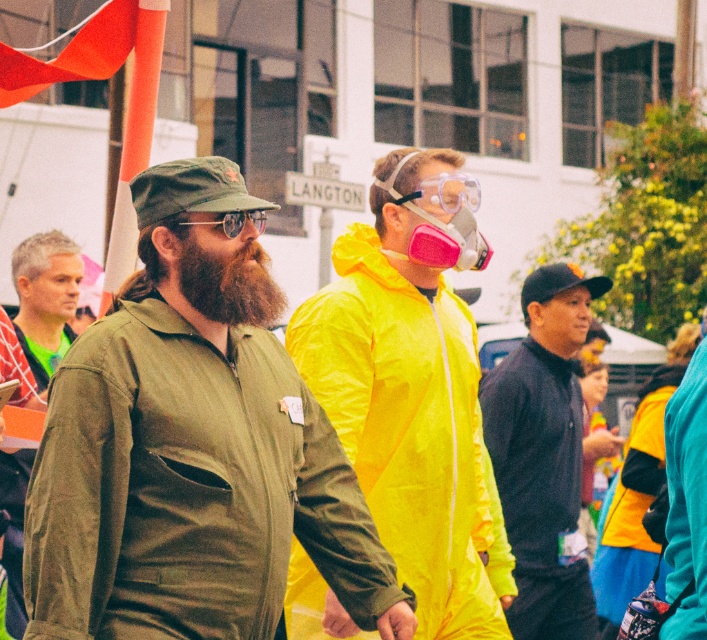
Is black fleece jacket at center above matte green jacket at left?

Incorrect, black fleece jacket at center is not positioned above matte green jacket at left.

Can you confirm if black fleece jacket at center is taller than matte green jacket at left?

No, black fleece jacket at center is not taller than matte green jacket at left.

Is point (520, 579) positioned in front of point (5, 540)?

No, (520, 579) is behind (5, 540).

At what (x,y) coordinates should I click in order to perform the action: click on black fleece jacket at center. Please return your answer as a coordinate pair (x, y). Image resolution: width=707 pixels, height=640 pixels. Looking at the image, I should click on (543, 452).

Identify the location of matte green jacket at left. (45, 300).

Who is more distant from viewer, (64, 292) or (461, 202)?

The point (64, 292) is more distant.

Is point (35, 282) farther from viewer compared to point (438, 182)?

Yes, point (35, 282) is farther from viewer.

What are the coordinates of `matte green jacket at left` in the screenshot? It's located at (45, 300).

Does brownwoollybeard at center have a greater width compared to reflective plastic goggles at center?

Indeed, brownwoollybeard at center has a greater width compared to reflective plastic goggles at center.

Is brownwoollybeard at center positioned behind reflective plastic goggles at center?

No, brownwoollybeard at center is in front of reflective plastic goggles at center.

Which is behind, point (255, 300) or point (235, 227)?

Point (235, 227)

At what (x,y) coordinates should I click in order to perform the action: click on brownwoollybeard at center. Please return your answer as a coordinate pair (x, y). The height and width of the screenshot is (640, 707). Looking at the image, I should click on (228, 284).